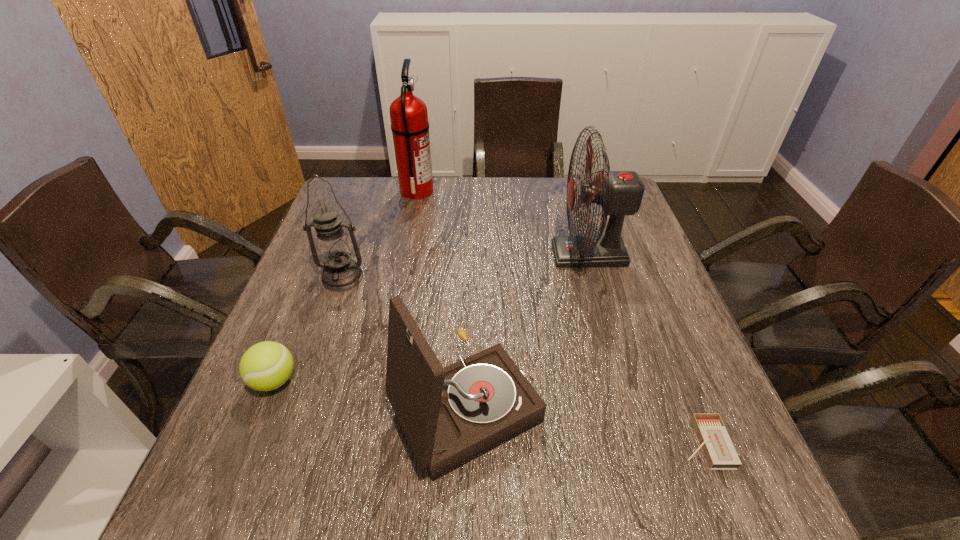
I want to click on fan at the right edge, so click(x=619, y=193).

At what (x,y) coordinates should I click in order to perform the action: click on matchbox located at the right edge. Please return your answer as a coordinate pair (x, y). Looking at the image, I should click on (718, 449).

The height and width of the screenshot is (540, 960). In the image, there is a desktop. What are the coordinates of `vacant space at the far edge` in the screenshot? It's located at (468, 214).

Where is `vacant position at the near edge of the desktop`? vacant position at the near edge of the desktop is located at coordinates (531, 477).

Locate an element on the screen. This screenshot has width=960, height=540. vacant space at the left edge of the desktop is located at coordinates tap(289, 453).

Identify the location of blank space at the right edge of the desktop. (627, 359).

Locate an element on the screen. This screenshot has width=960, height=540. free space at the near left corner of the desktop is located at coordinates (256, 493).

The width and height of the screenshot is (960, 540). In order to click on free region at the near right corner of the desktop in this screenshot , I will do `click(711, 517)`.

Where is `free area in between the oil lamp and the shortest object`? The width and height of the screenshot is (960, 540). free area in between the oil lamp and the shortest object is located at coordinates (523, 361).

Find the location of `vacant space in between the tennis ball and the oil lamp`. vacant space in between the tennis ball and the oil lamp is located at coordinates (308, 329).